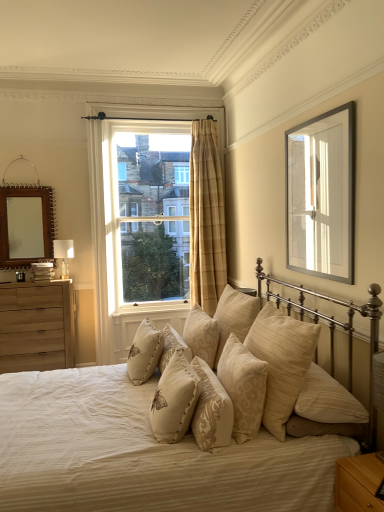
Describe the element at coordinates (281, 362) in the screenshot. I see `beige textured pillows at center, the 8th pillow from the left` at that location.

Where is `beige textured pillow at center, which is the 2th pillow in right-to-left order`? Image resolution: width=384 pixels, height=512 pixels. beige textured pillow at center, which is the 2th pillow in right-to-left order is located at coordinates (234, 316).

Locate an element on the screen. beige fabric pillow with embroidered moth at center, acting as the 1th pillow starting from the left is located at coordinates (144, 352).

From the image's perspective, between beige embroidered pillow at center, the 6th pillow positioned from the right, and light brown wood nightstand at lower right, which one is located above?

beige embroidered pillow at center, the 6th pillow positioned from the right.

Is beige embroidered pillow at center, acting as the third pillow starting from the left, bigger than light brown wood nightstand at lower right?

Correct, beige embroidered pillow at center, acting as the third pillow starting from the left, is larger in size than light brown wood nightstand at lower right.

Is beige embroidered pillow at center, acting as the third pillow starting from the left, looking in the opposite direction of light brown wood nightstand at lower right?

That's not correct — beige embroidered pillow at center, acting as the third pillow starting from the left, is not looking away from light brown wood nightstand at lower right.

From the picture: Is beige embroidered pillow at center, the 6th pillow positioned from the right, facing towards beige textured pillows at center, which is counted as the 1th pillow, starting from the right?

No.

Is beige embroidered pillow at center, the 6th pillow positioned from the right, next to beige textured pillows at center, which is counted as the 1th pillow, starting from the right?

beige embroidered pillow at center, the 6th pillow positioned from the right, and beige textured pillows at center, which is counted as the 1th pillow, starting from the right, are clearly separated.

Locate an element on the screen. Image resolution: width=384 pixels, height=512 pixels. pillow that is the 2nd object located in front of the beige textured pillows at center, the 8th pillow from the left is located at coordinates (174, 400).

From the image's perspective, is beige embroidered pillow at center, acting as the third pillow starting from the left, on beige textured pillows at center, the 8th pillow from the left?

No.

Is beige embroidered pillow at center, arranged as the fourth pillow when viewed from the right, inside the boundaries of light brown wood nightstand at lower right, or outside?

beige embroidered pillow at center, arranged as the fourth pillow when viewed from the right, is not inside light brown wood nightstand at lower right, it's outside.

Can you tell me how much beige embroidered pillow at center, the fifth pillow when ordered from left to right, and light brown wood nightstand at lower right differ in facing direction?

The angle between the facing direction of beige embroidered pillow at center, the fifth pillow when ordered from left to right, and the facing direction of light brown wood nightstand at lower right is 6.1 degrees.

Is beige embroidered pillow at center, arranged as the fourth pillow when viewed from the right, in front of or behind light brown wood nightstand at lower right in the image?

Visually, beige embroidered pillow at center, arranged as the fourth pillow when viewed from the right, is located behind light brown wood nightstand at lower right.

Is beige fabric pillow with embroidered moth at center, the 8th pillow when ordered from right to left, not near beige textured pillows at center, which is counted as the 1th pillow, starting from the right?

No.

Between beige fabric pillow with embroidered moth at center, acting as the 1th pillow starting from the left, and beige textured pillows at center, the 8th pillow from the left, which one has more height?

Standing taller between the two is beige textured pillows at center, the 8th pillow from the left.

What are the coordinates of `the 3rd pillow behind the beige textured pillows at center, which is counted as the 1th pillow, starting from the right` in the screenshot? It's located at (144, 352).

From the image's perspective, is beige fabric pillow with embroidered moth at center, the 8th pillow when ordered from right to left, on beige textured pillows at center, which is counted as the 1th pillow, starting from the right?

No.

Can you confirm if beige embroidered pillow at center, arranged as the fourth pillow when viewed from the right, is shorter than beige textured pillow at center, marked as the 5th pillow in a right-to-left arrangement?

Yes.

From a real-world perspective, between beige embroidered pillow at center, arranged as the fourth pillow when viewed from the right, and beige textured pillow at center, marked as the 5th pillow in a right-to-left arrangement, who is vertically higher?

From a 3D spatial view, beige textured pillow at center, marked as the 5th pillow in a right-to-left arrangement, is above.

Which pillow is the 1st one when counting from the right side of the beige textured pillow at center, which appears as the fourth pillow when viewed from the left? Please provide its 2D coordinates.

[(211, 410)]

Considering their positions, is beige embroidered pillow at center, the fifth pillow when ordered from left to right, located in front of or behind beige textured pillow at center, marked as the 5th pillow in a right-to-left arrangement?

Clearly, beige embroidered pillow at center, the fifth pillow when ordered from left to right, is in front of beige textured pillow at center, marked as the 5th pillow in a right-to-left arrangement.

Would you say beige fabric pillow at center, which is the 7th pillow in right-to-left order, is part of beige textured pillows at center, the 8th pillow from the left,'s contents?

No, beige fabric pillow at center, which is the 7th pillow in right-to-left order, is not a part of beige textured pillows at center, the 8th pillow from the left.

Is beige textured pillows at center, which is counted as the 1th pillow, starting from the right, at the left side of beige fabric pillow at center, which is the 7th pillow in right-to-left order?

Incorrect, beige textured pillows at center, which is counted as the 1th pillow, starting from the right, is not on the left side of beige fabric pillow at center, which is the 7th pillow in right-to-left order.

From the image's perspective, is beige textured pillows at center, which is counted as the 1th pillow, starting from the right, under beige fabric pillow at center, which is the 7th pillow in right-to-left order?

No.

Considering the sizes of objects beige textured pillows at center, which is counted as the 1th pillow, starting from the right, and beige fabric pillow at center, the 2th pillow viewed from the left, in the image provided, who is taller, beige textured pillows at center, which is counted as the 1th pillow, starting from the right, or beige fabric pillow at center, the 2th pillow viewed from the left,?

beige textured pillows at center, which is counted as the 1th pillow, starting from the right.

From the image's perspective, between beige textured pillow at center, which is the 2th pillow in right-to-left order, and beige textured pillows at center, which is counted as the 1th pillow, starting from the right, who is located below?

From the image's view, beige textured pillows at center, which is counted as the 1th pillow, starting from the right, is below.

Considering the sizes of objects beige textured pillow at center, the 7th pillow when ordered from left to right, and beige textured pillows at center, which is counted as the 1th pillow, starting from the right, in the image provided, who is taller, beige textured pillow at center, the 7th pillow when ordered from left to right, or beige textured pillows at center, which is counted as the 1th pillow, starting from the right,?

beige textured pillows at center, which is counted as the 1th pillow, starting from the right.

Is beige textured pillow at center, the 7th pillow when ordered from left to right, oriented away from beige textured pillows at center, which is counted as the 1th pillow, starting from the right?

No, beige textured pillows at center, which is counted as the 1th pillow, starting from the right, is not at the back of beige textured pillow at center, the 7th pillow when ordered from left to right.

The height and width of the screenshot is (512, 384). I want to click on nightstand that appears below the beige embroidered pillow at center, the 6th pillow positioned from the right (from a real-world perspective), so click(358, 484).

Starting from the beige embroidered pillow at center, the 6th pillow positioned from the right, which pillow is the 2nd one behind? Please provide its 2D coordinates.

[(281, 362)]

Which object lies nearer to the anchor point beige fabric pillow with embroidered moth at center, the 8th pillow when ordered from right to left, beige textured pillow at center, which appears as the fourth pillow when viewed from the left, or silver metallic picture frame at upper right?

Based on the image, beige textured pillow at center, which appears as the fourth pillow when viewed from the left, appears to be nearer to beige fabric pillow with embroidered moth at center, the 8th pillow when ordered from right to left.

Based on their spatial positions, is beige textured pillow at center, which appears as the fourth pillow when viewed from the left, or natural wood dresser at left closer to beige fabric pillow with embroidered moth at center, the 8th pillow when ordered from right to left?

Based on the image, beige textured pillow at center, which appears as the fourth pillow when viewed from the left, appears to be nearer to beige fabric pillow with embroidered moth at center, the 8th pillow when ordered from right to left.

Based on their spatial positions, is beige embroidered pillow at center, acting as the third pillow starting from the left, or beige embroidered pillow at center, arranged as the fourth pillow when viewed from the right, closer to beige textured pillow at center, marked as the 6th pillow in a left-to-right arrangement?

The object closer to beige textured pillow at center, marked as the 6th pillow in a left-to-right arrangement, is beige embroidered pillow at center, arranged as the fourth pillow when viewed from the right.

Consider the image. Considering their positions, is beige fabric pillow at center, the 2th pillow viewed from the left, positioned closer to beige textured pillow at center, which appears as the fourth pillow when viewed from the left, than natural wood dresser at left?

beige fabric pillow at center, the 2th pillow viewed from the left, lies closer to beige textured pillow at center, which appears as the fourth pillow when viewed from the left, than the other object.

When comparing their distances from beige fabric pillow at center, the 2th pillow viewed from the left, does beige fabric pillow with embroidered moth at center, acting as the 1th pillow starting from the left, or beige textured pillow at center, which is the 3th pillow in right-to-left order, seem closer?

beige fabric pillow with embroidered moth at center, acting as the 1th pillow starting from the left, is closer to beige fabric pillow at center, the 2th pillow viewed from the left.

When comparing their distances from beige fabric pillow at center, the 2th pillow viewed from the left, does beige textured curtain at center or silver metallic picture frame at upper right seem further?

beige textured curtain at center is positioned further to the anchor beige fabric pillow at center, the 2th pillow viewed from the left.

When comparing their distances from beige embroidered pillow at center, the 6th pillow positioned from the right, does beige textured curtain at center or white fabric lampshade at left seem closer?

The object closer to beige embroidered pillow at center, the 6th pillow positioned from the right, is white fabric lampshade at left.

Which object lies further to the anchor point beige textured pillow at center, which is the 2th pillow in right-to-left order, silver metallic picture frame at upper right or natural wood dresser at left?

The object further to beige textured pillow at center, which is the 2th pillow in right-to-left order, is natural wood dresser at left.

Find the location of `mirror positioned between beige fabric bed at center and beige textured curtain at center from near to far`. mirror positioned between beige fabric bed at center and beige textured curtain at center from near to far is located at coordinates (26, 225).

Identify the location of nightstand between beige fabric bed at center and beige fabric pillow with embroidered moth at center, the 8th pillow when ordered from right to left, in the front-back direction. (358, 484).

The height and width of the screenshot is (512, 384). Find the location of `lamp between natural wood dresser at left and beige textured pillows at center, the 8th pillow from the left, from left to right`. lamp between natural wood dresser at left and beige textured pillows at center, the 8th pillow from the left, from left to right is located at coordinates (63, 254).

Locate an element on the screen. This screenshot has width=384, height=512. picture frame located between beige embroidered pillow at center, the fifth pillow when ordered from left to right, and white fabric lampshade at left in the depth direction is located at coordinates (321, 195).